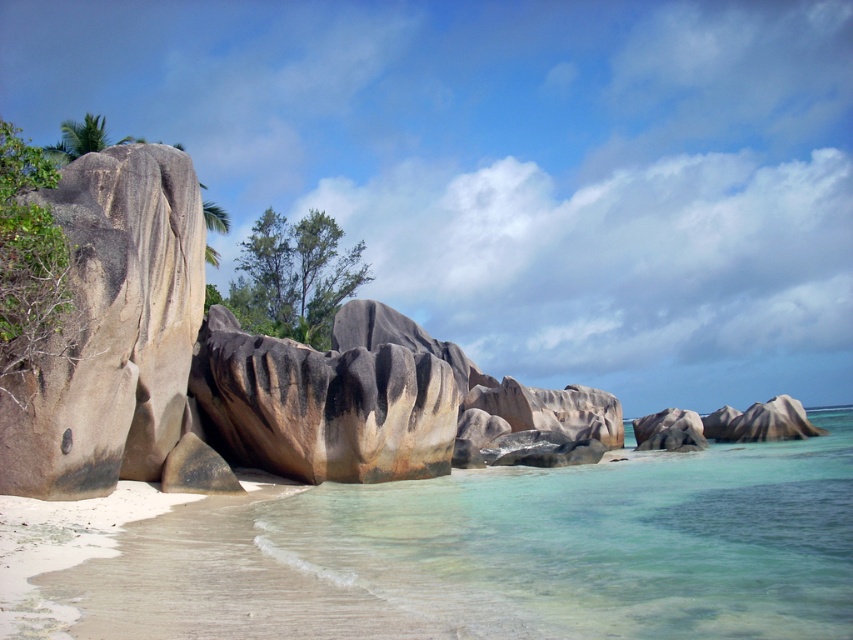
The height and width of the screenshot is (640, 853). Identify the location of clear glassy water at lower center. (601, 541).

Who is higher up, clear glassy water at lower center or rustic stone boulder at left?

rustic stone boulder at left is above.

Locate an element on the screen. This screenshot has width=853, height=640. clear glassy water at lower center is located at coordinates (601, 541).